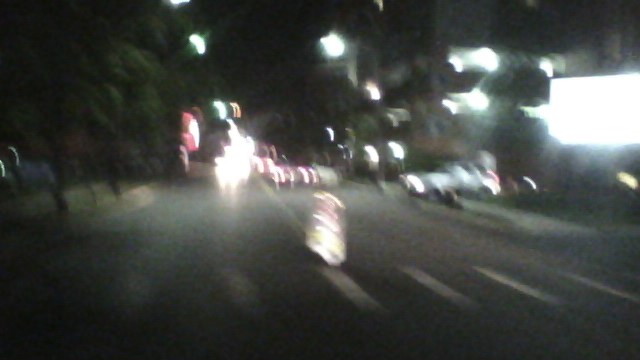
At what (x,y) coordinates should I click in order to perform the action: click on top left light. Please return your answer as a coordinate pair (x, y). This screenshot has height=360, width=640. Looking at the image, I should click on (195, 48).